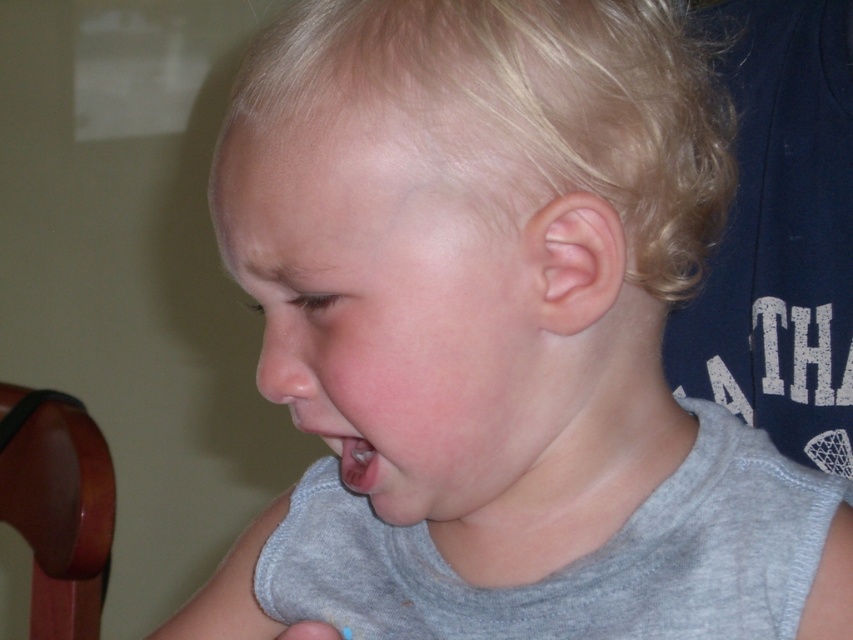
Which is behind, point (73, 582) or point (294, 422)?

The point (73, 582) is more distant.

Between point (88, 566) and point (299, 420), which one is positioned behind?

The point (88, 566) is more distant.

Where is `brown wood chair at lower left`? Image resolution: width=853 pixels, height=640 pixels. brown wood chair at lower left is located at coordinates (57, 506).